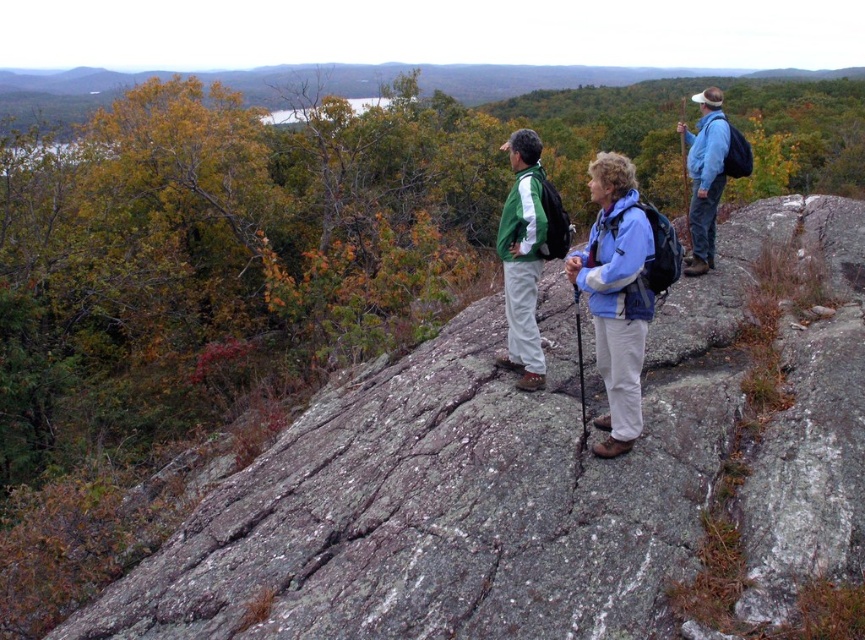
You are a photographer trying to capture both the blue fabric jacket at center and the blue fabric jacket at upper right in a single frame. Which jacket should you focus on to ensure both are in the frame without moving the camera?

You should focus on the blue fabric jacket at center because it is smaller in size compared to the blue fabric jacket at upper right, allowing both to fit within the camera frame.

You are a hiker planning to place a small marker at point (530, 480). What object will the marker be placed on?

The marker will be placed on the gray rough rock at center located at point (530, 480).